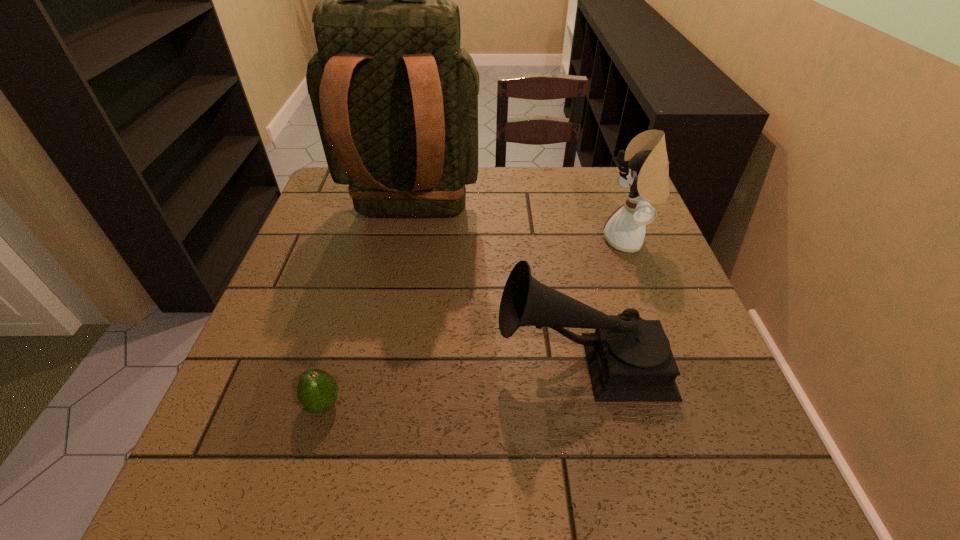
Where is `free space that is in between the second tallest object and the shortest object`? free space that is in between the second tallest object and the shortest object is located at coordinates (476, 322).

The image size is (960, 540). Find the location of `free space between the third tallest object and the third shortest object`. free space between the third tallest object and the third shortest object is located at coordinates (605, 300).

You are a GUI agent. You are given a task and a screenshot of the screen. Output one action in this format:
    pyautogui.click(x=<x>, y=<y>)
    Task: Click on the vacant area that lies between the third shortest object and the backpack
    Image resolution: width=960 pixels, height=540 pixels.
    Given the screenshot: What is the action you would take?
    pyautogui.click(x=520, y=228)

Find the location of a particular element. vacant area that lies between the tallest object and the third tallest object is located at coordinates (496, 288).

This screenshot has height=540, width=960. In order to click on unoccupied area between the phonograph_record and the tallest object in this screenshot , I will do `click(496, 288)`.

I want to click on object that can be found as the second closest to the doll, so coord(395,99).

Identify the location of object that ranks as the third closest to the second tallest object. (317, 391).

You are a GUI agent. You are given a task and a screenshot of the screen. Output one action in this format:
    pyautogui.click(x=<x>, y=<y>)
    Task: Click on the blank area in the image that satisfies the following two spatial constraints: 1. from the horn of the third tallest object; 2. on the front side of the avocado
    
    Given the screenshot: What is the action you would take?
    pyautogui.click(x=590, y=404)